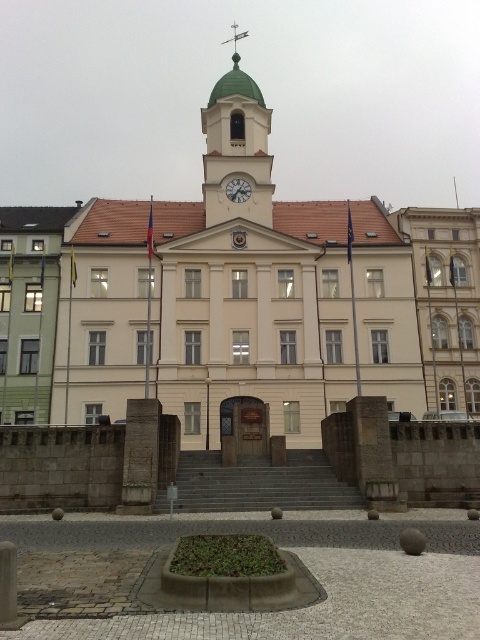
You are standing in front of the building and want to locate the metallic clock at center. Which direction should you look relative to the green dome clock tower at center?

The metallic clock at center is to the right of the green dome clock tower at center.

You are standing at the point marked by coordinates point (x=237, y=147) in the plaza. Which building feature is directly in front of you?

The point (x=237, y=147) marks the green dome clock tower at center, so the green dome clock tower at center is directly in front of you.